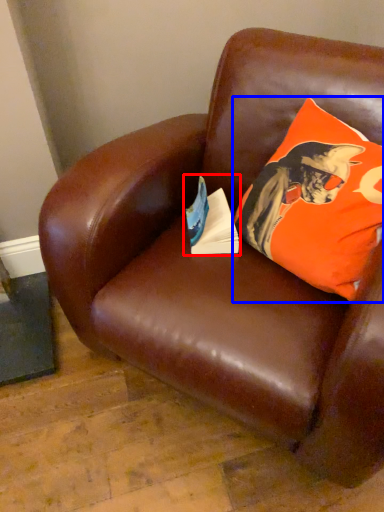
Question: Among these objects, which one is nearest to the camera, paperback book (highlighted by a red box) or pillow (highlighted by a blue box)?

Choices:
 (A) paperback book
 (B) pillow

Answer: (B)